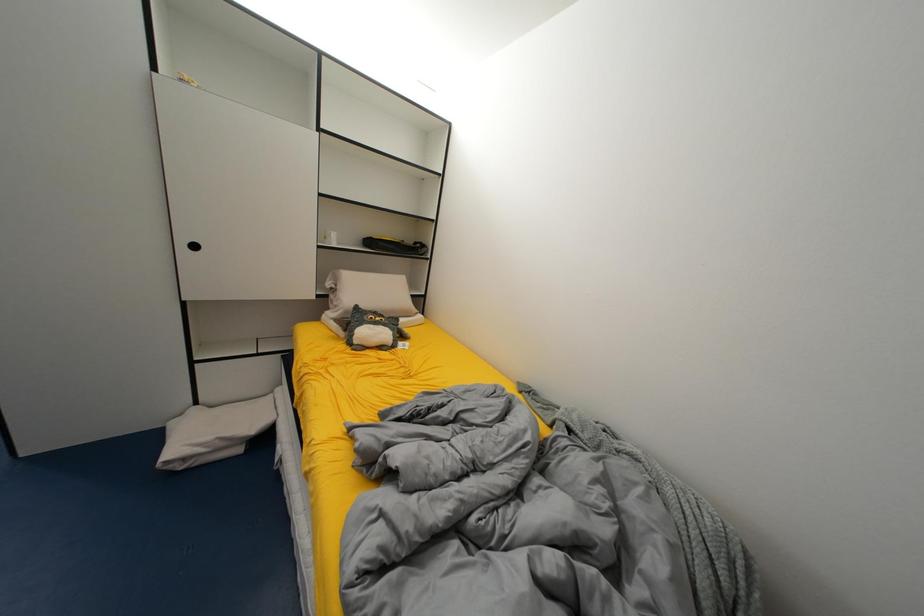
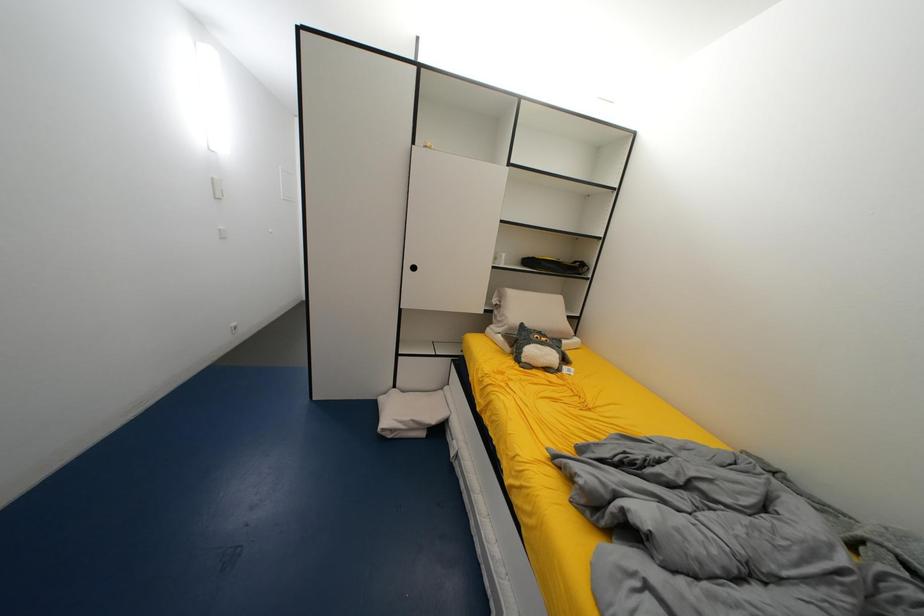
Question: Which direction would the cameraman need to move to produce the second image? Reply with the corresponding letter.

Choices:
 (A) Left
 (B) Right
 (C) Forward
 (D) Backward

Answer: (A)